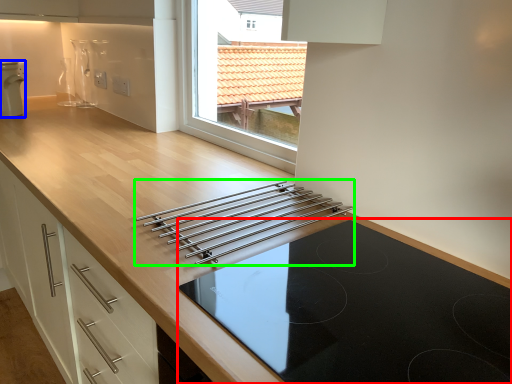
Question: Which is nearer to the gas stove (highlighted by a red box)? home appliance (highlighted by a blue box) or kitchen appliance (highlighted by a green box).

Choices:
 (A) home appliance
 (B) kitchen appliance

Answer: (B)